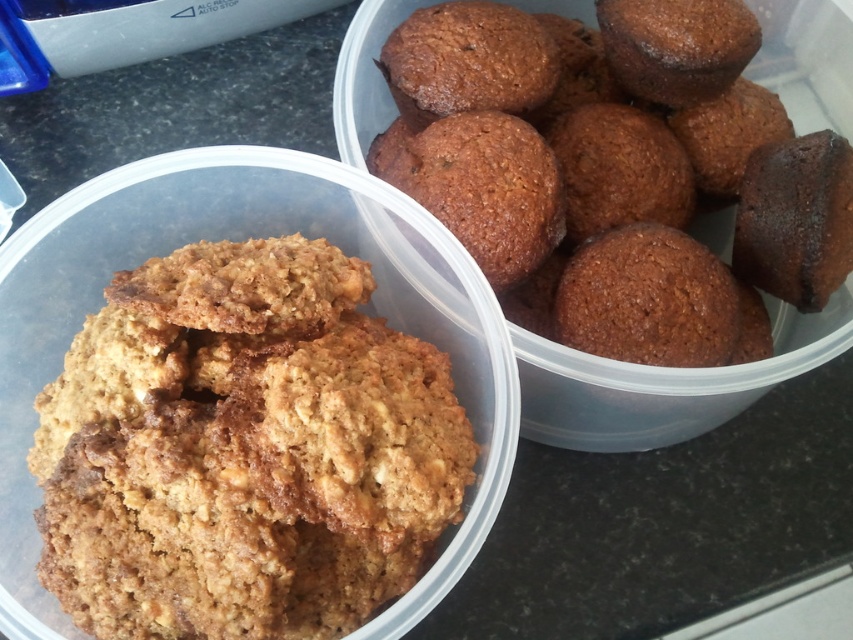
Question: Does golden brown textured cookies at center have a smaller size compared to brown matte muffin at upper right?

Choices:
 (A) no
 (B) yes

Answer: (B)

Question: In this image, where is golden brown textured cookies at center located relative to brown matte muffin at upper right?

Choices:
 (A) right
 (B) left

Answer: (B)

Question: Which point appears closest to the camera in this image?

Choices:
 (A) (180, 244)
 (B) (405, 109)

Answer: (A)

Question: Is golden brown textured cookies at center to the left of brown matte muffin at upper right from the viewer's perspective?

Choices:
 (A) no
 (B) yes

Answer: (B)

Question: Among these points, which one is farthest from the camera?

Choices:
 (A) (480, 388)
 (B) (440, 113)

Answer: (B)